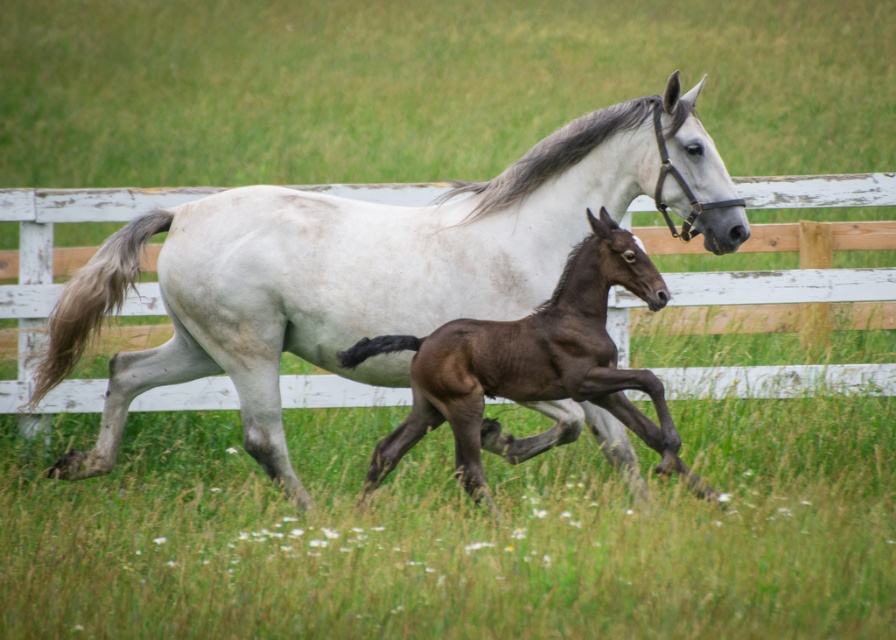
You are a photographer aiming to capture both the white glossy horse at center and the shiny brown foal at center in a single frame. Based on their positions, which horse should you focus on first to ensure both are in the shot?

The white glossy horse at center is positioned on the left side of the shiny brown foal at center, so focusing on the foal first would allow you to frame both horses since they are centrally aligned with the foal slightly to the right.

You are a photographer trying to capture both the white glossy horse at center and the shiny brown foal at center in a single frame. Based on their sizes, which horse should you focus on first to ensure both fit in the photo?

The white glossy horse at center is larger in size than the shiny brown foal at center, so you should focus on positioning the larger horse first to ensure both fit within the frame.

You are a farmer who wants to build a fence that can accommodate both the white glossy horse at center and the shiny brown foal at center. What should you consider about their sizes?

The white glossy horse at center is much taller than the shiny brown foal at center, so the fence needs to be tall enough to contain the taller horse while also ensuring the foal cannot escape through any gaps.